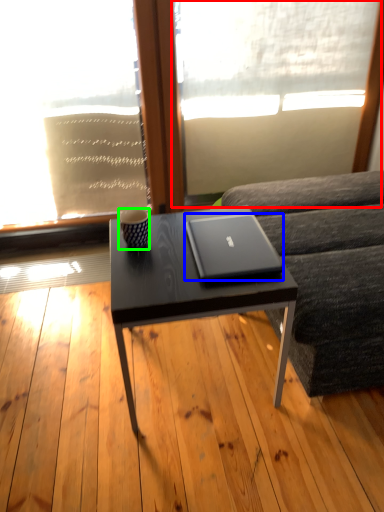
Question: Considering the real-world distances, which object is farthest from window screen (highlighted by a red box)? laptop (highlighted by a blue box) or coffee cup (highlighted by a green box)?

Choices:
 (A) laptop
 (B) coffee cup

Answer: (B)